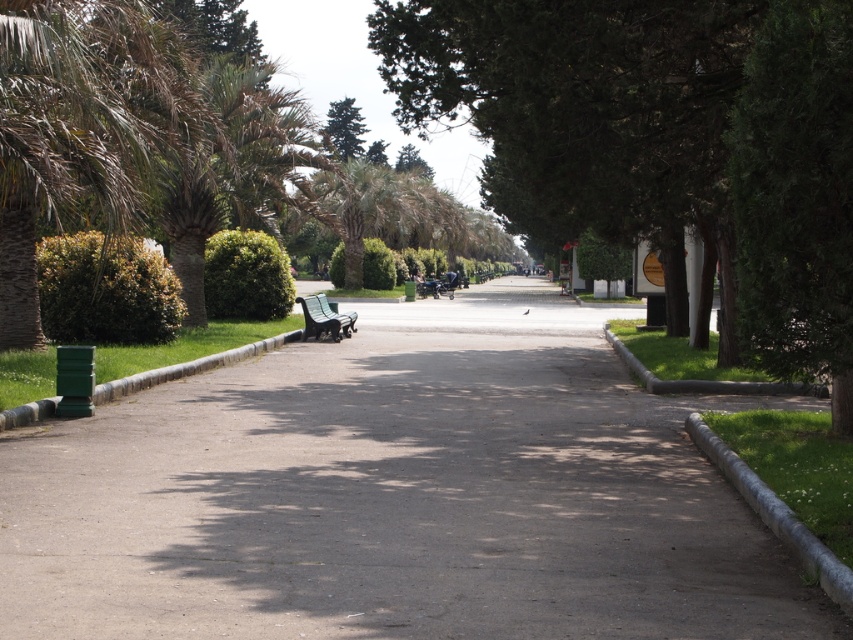
You are standing at the starting point of the pathway and want to reach the green leafy tree at center. Based on the coordinates provided, in which direction should you walk from your current position?

The green leafy tree at center is located at point 0.225 on the x and 0.778 on the y. Since you are at the starting point, which is likely at the origin, you should walk towards the northeast direction to reach it.

Consider the image. You are planning to place a new flower pot that is 1.2 meters wide on the gray asphalt pavement at center. Considering the size of the green plastic bench at center, will there be enough space to place the flower pot without overlapping the bench?

The gray asphalt pavement at center has a larger size compared to the green plastic bench at center. Since the flower pot is 1.2 meters wide, there should be enough space on the gray asphalt pavement at center to place it without overlapping the bench.